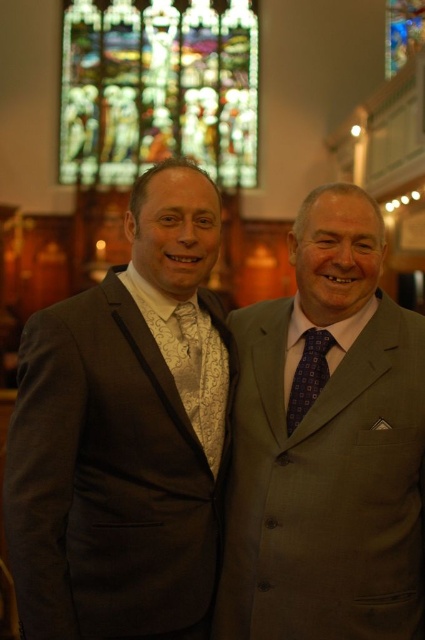
Is gray wool suit at right closer to the viewer compared to stained glass at upper center?

Yes.

Between gray wool suit at right and stained glass at upper center, which one has more height?

Standing taller between the two is gray wool suit at right.

Who is more distant from viewer, (308,355) or (116,8)?

Positioned behind is point (116,8).

This screenshot has width=425, height=640. Find the location of `gray wool suit at right`. gray wool suit at right is located at coordinates (326, 445).

Find the location of `stained glass at upper center`. stained glass at upper center is located at coordinates tap(158, 88).

The image size is (425, 640). I want to click on stained glass at upper center, so click(158, 88).

The height and width of the screenshot is (640, 425). What are the coordinates of `stained glass at upper center` in the screenshot? It's located at (158, 88).

Between gray wool suit at right and stained glass window at upper center, which one has less height?

stained glass window at upper center

From the picture: Does gray wool suit at right appear under stained glass window at upper center?

Indeed, gray wool suit at right is positioned under stained glass window at upper center.

Is point (380, 449) positioned after point (404, 42)?

No, (380, 449) is in front of (404, 42).

You are a GUI agent. You are given a task and a screenshot of the screen. Output one action in this format:
    pyautogui.click(x=<x>, y=<y>)
    Task: Click on the gray wool suit at right
    The width and height of the screenshot is (425, 640).
    Given the screenshot: What is the action you would take?
    pyautogui.click(x=326, y=445)